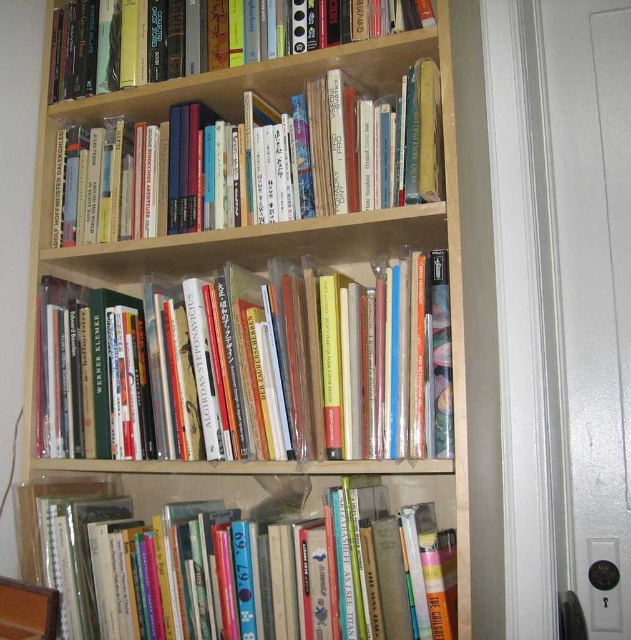
The image size is (631, 640). Find the location of `hardcover books at center`. hardcover books at center is located at coordinates (254, 371).

Which is behind, point (372, 340) or point (239, 45)?

Point (239, 45)

The width and height of the screenshot is (631, 640). I want to click on hardcover books at center, so click(254, 371).

From the picture: Between hardcover books at upper center and hardcover books at upper left, which one is positioned higher?

hardcover books at upper left is above.

Find the location of a particular element. Image resolution: width=631 pixels, height=640 pixels. hardcover books at upper center is located at coordinates point(252,163).

This screenshot has width=631, height=640. Find the location of `hardcover books at upper center`. hardcover books at upper center is located at coordinates (252, 163).

Identify the location of hardcover books at upper center. (252, 163).

Is hardcover books at center bigger than hardcover books at lower center?

No.

In the scene shown: Does hardcover books at center appear on the left side of hardcover books at lower center?

In fact, hardcover books at center is to the right of hardcover books at lower center.

Identify the location of hardcover books at center. The height and width of the screenshot is (640, 631). (254, 371).